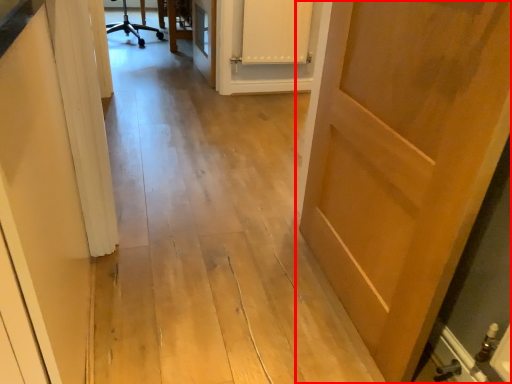
Question: From the image's perspective, where is door (annotated by the red box) located relative to cabinetry?

Choices:
 (A) above
 (B) below

Answer: (B)